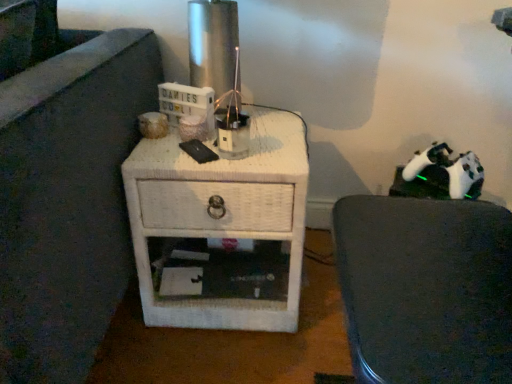
Question: Is point (470, 307) positioned closer to the camera than point (143, 155)?

Choices:
 (A) closer
 (B) farther

Answer: (A)

Question: Considering their positions, is white matte chair at right located in front of or behind white wicker nightstand at center?

Choices:
 (A) front
 (B) behind

Answer: (A)

Question: From the image's perspective, is white matte chair at right above or below white wicker nightstand at center?

Choices:
 (A) below
 (B) above

Answer: (A)

Question: In the image, is white wicker nightstand at center on the left side or the right side of white matte chair at right?

Choices:
 (A) left
 (B) right

Answer: (A)

Question: Considering the positions of white wicker nightstand at center and white matte chair at right in the image, is white wicker nightstand at center bigger or smaller than white matte chair at right?

Choices:
 (A) small
 (B) big

Answer: (B)

Question: Is white wicker nightstand at center taller or shorter than white matte chair at right?

Choices:
 (A) tall
 (B) short

Answer: (B)

Question: In terms of width, does white wicker nightstand at center look wider or thinner when compared to white matte chair at right?

Choices:
 (A) thin
 (B) wide

Answer: (B)